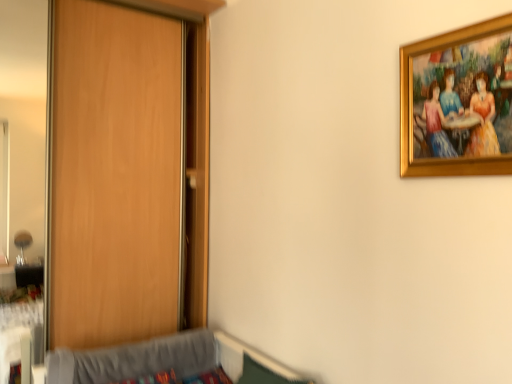
Question: Should I look upward or downward to see gold-framed painting at upper right?

Choices:
 (A) down
 (B) up

Answer: (B)

Question: Does wooden door at left have a larger size compared to gold-framed painting at upper right?

Choices:
 (A) yes
 (B) no

Answer: (A)

Question: Does wooden door at left have a smaller size compared to gold-framed painting at upper right?

Choices:
 (A) no
 (B) yes

Answer: (A)

Question: Could you tell me if wooden door at left is turned towards gold-framed painting at upper right?

Choices:
 (A) no
 (B) yes

Answer: (B)

Question: Can you confirm if wooden door at left is shorter than gold-framed painting at upper right?

Choices:
 (A) yes
 (B) no

Answer: (B)

Question: Is wooden door at left to the left of gold-framed painting at upper right from the viewer's perspective?

Choices:
 (A) no
 (B) yes

Answer: (B)

Question: Are wooden door at left and gold-framed painting at upper right making contact?

Choices:
 (A) no
 (B) yes

Answer: (A)

Question: Does gray fabric hospital bed at lower left have a smaller size compared to gold-framed painting at upper right?

Choices:
 (A) yes
 (B) no

Answer: (B)

Question: Is gray fabric hospital bed at lower left completely or partially outside of gold-framed painting at upper right?

Choices:
 (A) yes
 (B) no

Answer: (A)

Question: Is gray fabric hospital bed at lower left surrounding gold-framed painting at upper right?

Choices:
 (A) no
 (B) yes

Answer: (A)

Question: Does gray fabric hospital bed at lower left have a lesser height compared to gold-framed painting at upper right?

Choices:
 (A) no
 (B) yes

Answer: (B)

Question: Is the depth of gray fabric hospital bed at lower left greater than that of gold-framed painting at upper right?

Choices:
 (A) no
 (B) yes

Answer: (B)

Question: From a real-world perspective, is gray fabric hospital bed at lower left below gold-framed painting at upper right?

Choices:
 (A) no
 (B) yes

Answer: (B)

Question: Does gold-framed painting at upper right have a smaller size compared to wooden door at left?

Choices:
 (A) yes
 (B) no

Answer: (A)